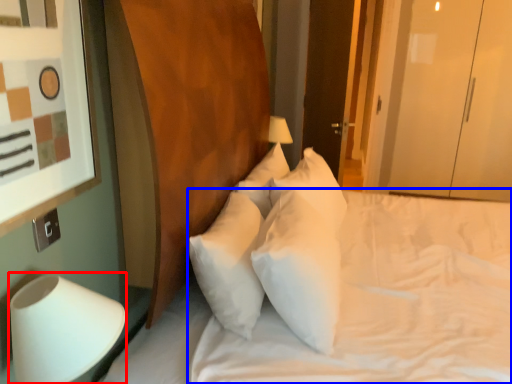
Question: Which of the following is the closest to the observer, table lamp (highlighted by a red box) or mattress (highlighted by a blue box)?

Choices:
 (A) table lamp
 (B) mattress

Answer: (A)